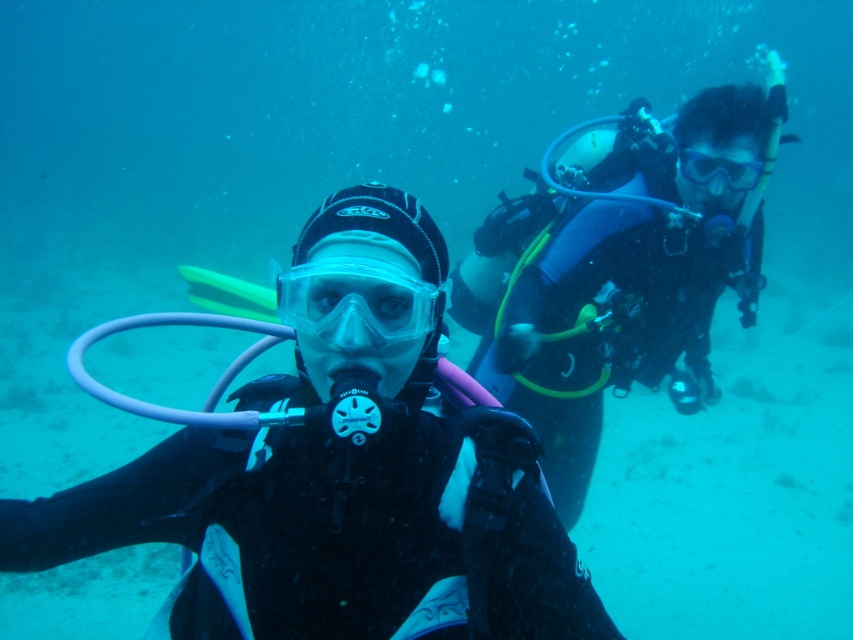
Does transparent plastic goggles at center appear on the right side of clear plastic goggles at center?

In fact, transparent plastic goggles at center is to the left of clear plastic goggles at center.

Between point (402, 326) and point (749, 188), which one is positioned behind?

The point (749, 188) is more distant.

This screenshot has height=640, width=853. I want to click on transparent plastic goggles at center, so click(357, 305).

Can you confirm if black matte wetsuit at center is shorter than black matte scuba diver at right?

Yes.

Who is lower down, black matte wetsuit at center or black matte scuba diver at right?

black matte wetsuit at center

Locate an element on the screen. This screenshot has height=640, width=853. black matte wetsuit at center is located at coordinates (339, 474).

Which is more to the left, black matte scuba diver at right or clear plastic goggles at center?

From the viewer's perspective, black matte scuba diver at right appears more on the left side.

Does black matte scuba diver at right appear under clear plastic goggles at center?

Yes.

Is point (672, 237) positioned behind point (746, 180)?

Yes, point (672, 237) is behind point (746, 180).

Find the location of a particular element. The width and height of the screenshot is (853, 640). black matte scuba diver at right is located at coordinates (622, 273).